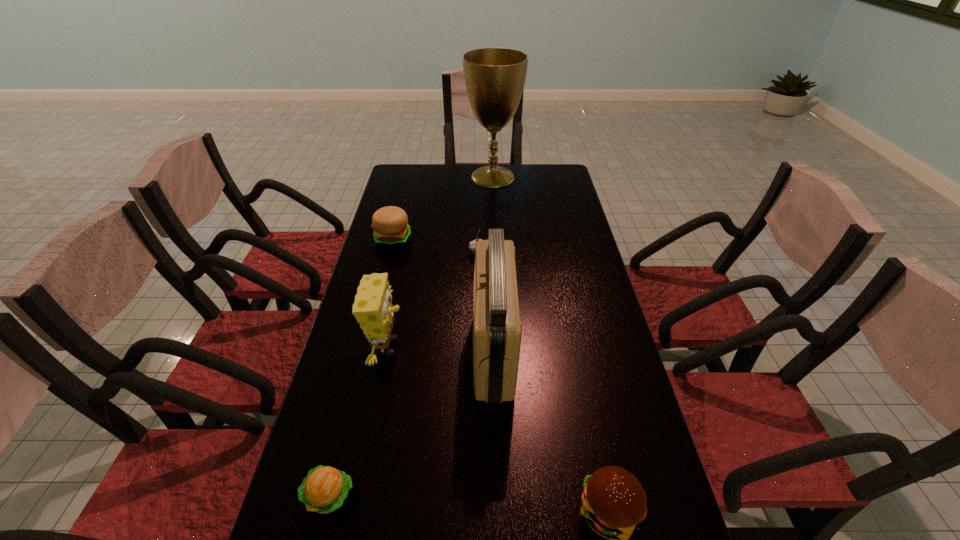
Find the location of a particular element. The width and height of the screenshot is (960, 540). vacant space at the far right corner is located at coordinates (529, 164).

The width and height of the screenshot is (960, 540). I want to click on vacant space that is in between the farthest hamburger and the tallest object, so click(443, 208).

The height and width of the screenshot is (540, 960). In order to click on vacant space that is in between the farthest object and the shortest hamburger in this screenshot , I will do `click(411, 336)`.

Identify the location of free spot between the shortest object and the trophy cup. This screenshot has width=960, height=540. (411, 336).

At what (x,y) coordinates should I click in order to perform the action: click on object that is the third closest one to the sixth tallest object. Please return your answer as a coordinate pair (x, y). Looking at the image, I should click on (372, 308).

Locate which object is the third closest to the trophy cup. Please provide its 2D coordinates. Your answer should be formatted as a tuple, i.e. [(x, y)], where the tuple contains the x and y coordinates of a point satisfying the conditions above.

[(497, 330)]

The height and width of the screenshot is (540, 960). What are the coordinates of `hamburger object that ranks as the second closest to the farthest hamburger` in the screenshot? It's located at click(614, 504).

The width and height of the screenshot is (960, 540). I want to click on the closest hamburger relative to the shortest object, so click(x=614, y=504).